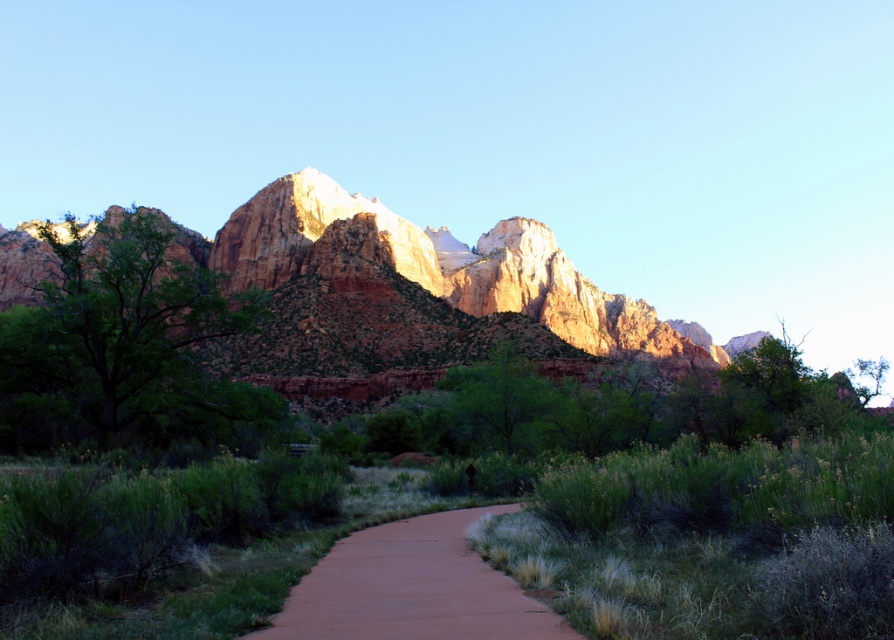
Is rustic rock formation at center positioned behind brown dirt path at center?

Yes, it is.

Can you confirm if rustic rock formation at center is positioned to the left of brown dirt path at center?

No, rustic rock formation at center is not to the left of brown dirt path at center.

Is point (344, 316) closer to viewer compared to point (384, 605)?

That is False.

Where is `rustic rock formation at center`? rustic rock formation at center is located at coordinates (410, 296).